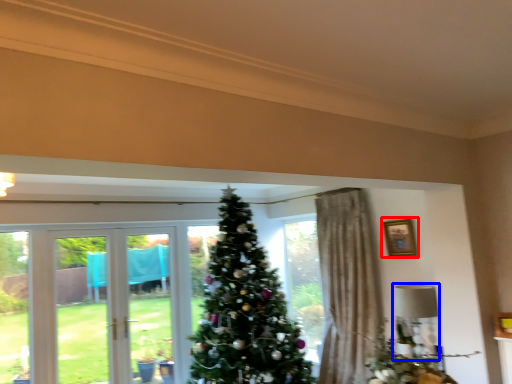
Question: Which object is closer to the camera taking this photo, picture frame (highlighted by a red box) or lamp (highlighted by a blue box)?

Choices:
 (A) picture frame
 (B) lamp

Answer: (B)